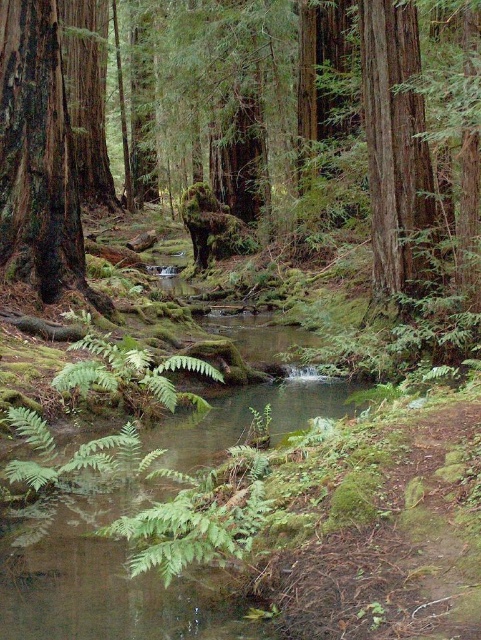
Is the position of smooth dark brown tree trunk at left more distant than that of smooth reddish-brown tree trunk at upper right?

No, it is not.

How much distance is there between smooth dark brown tree trunk at left and smooth reddish-brown tree trunk at upper right?

They are 3.88 meters apart.

Is point (0, 61) positioned in front of point (435, 230)?

Yes, point (0, 61) is closer to viewer.

Where is `smooth dark brown tree trunk at left`? The height and width of the screenshot is (640, 481). smooth dark brown tree trunk at left is located at coordinates (38, 156).